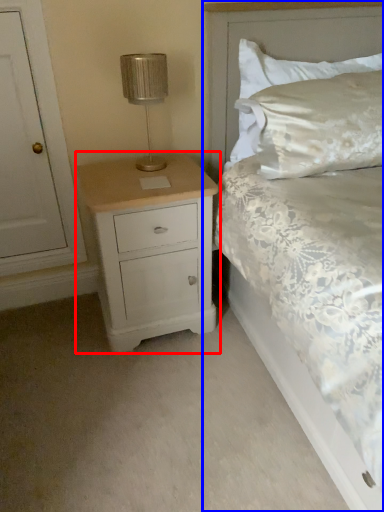
Question: Which object is closer to the camera taking this photo, chest of drawers (highlighted by a red box) or bed (highlighted by a blue box)?

Choices:
 (A) chest of drawers
 (B) bed

Answer: (B)